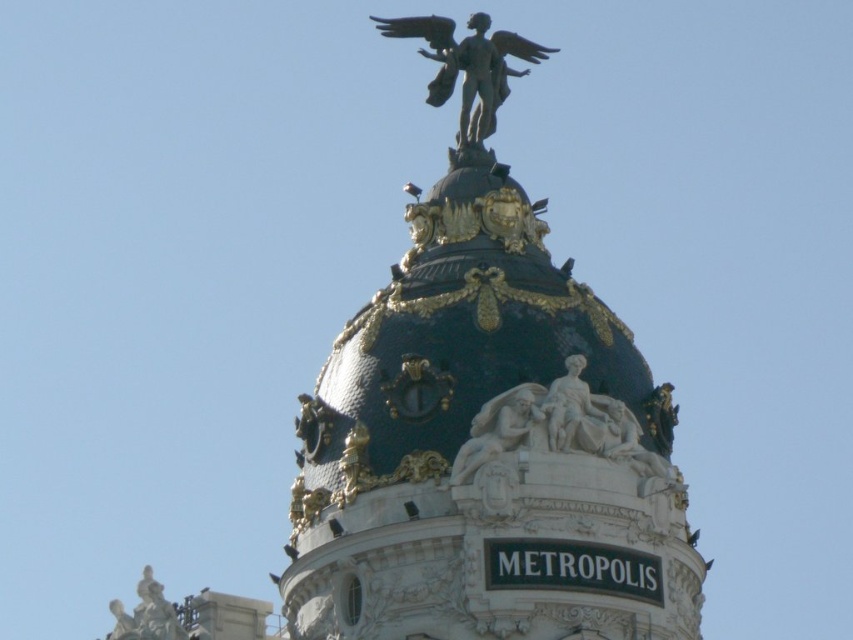
Is point (380, 474) closer to camera compared to point (566, 417)?

No, (380, 474) is behind (566, 417).

You are a GUI agent. You are given a task and a screenshot of the screen. Output one action in this format:
    pyautogui.click(x=<x>, y=<y>)
    Task: Click on the polished bronze statue at upper center
    
    Given the screenshot: What is the action you would take?
    pyautogui.click(x=483, y=426)

The width and height of the screenshot is (853, 640). What do you see at coordinates (483, 426) in the screenshot?
I see `polished bronze statue at upper center` at bounding box center [483, 426].

In order to click on polished bronze statue at upper center in this screenshot , I will do `click(483, 426)`.

Can you confirm if polished bronze statue at upper center is positioned to the left of bronze statue at lower left?

Incorrect, polished bronze statue at upper center is not on the left side of bronze statue at lower left.

Is polished bronze statue at upper center positioned in front of bronze statue at lower left?

Yes, polished bronze statue at upper center is in front of bronze statue at lower left.

Who is more distant from viewer, (x=351, y=385) or (x=144, y=625)?

The point (x=144, y=625) is behind.

This screenshot has width=853, height=640. Identify the location of polished bronze statue at upper center. [x=483, y=426].

Is white marble statue at center wider than bronze statue at lower left?

No, white marble statue at center is not wider than bronze statue at lower left.

Can you confirm if white marble statue at center is positioned below bronze statue at lower left?

No.

Locate an element on the screen. This screenshot has width=853, height=640. white marble statue at center is located at coordinates (573, 412).